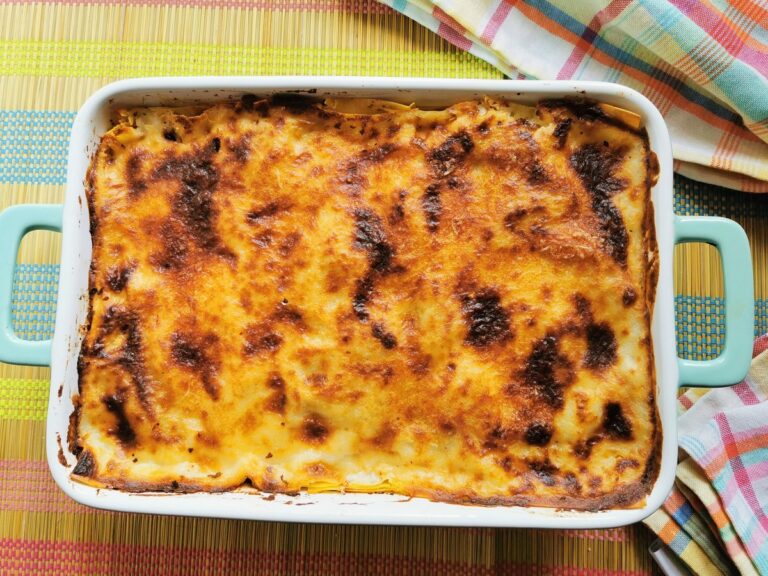
In order to click on dishcloth in this screenshot , I will do `click(700, 46)`.